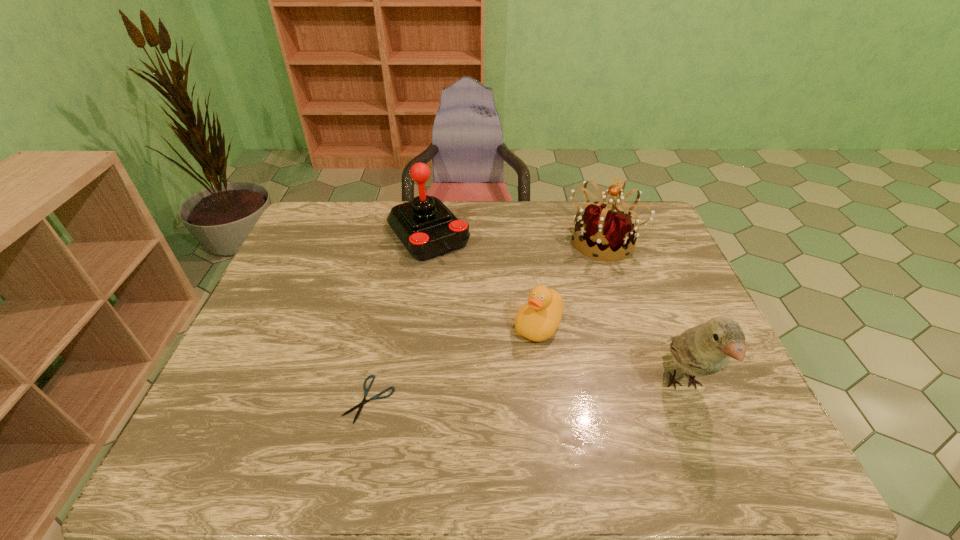
Identify the location of the shortest object. (366, 390).

The width and height of the screenshot is (960, 540). I want to click on bird, so click(705, 349).

I want to click on the third farthest object, so click(537, 320).

At what (x,y) coordinates should I click in order to perform the action: click on the third object from right to left. Please return your answer as a coordinate pair (x, y). Looking at the image, I should click on (537, 320).

This screenshot has width=960, height=540. Find the location of `joystick`. joystick is located at coordinates (427, 228).

Image resolution: width=960 pixels, height=540 pixels. What are the coordinates of `tiara` in the screenshot? It's located at (605, 227).

At what (x,y) coordinates should I click in order to perform the action: click on free region located 0.370m on the back of the shortest object. Please return your answer as a coordinate pair (x, y). Looking at the image, I should click on (396, 272).

Find the location of a particular element. The width and height of the screenshot is (960, 540). vacant space situated on the face of the third nearest object is located at coordinates (492, 392).

Locate an element on the screen. This screenshot has height=540, width=960. vacant space located 0.050m on the face of the third nearest object is located at coordinates (517, 357).

The width and height of the screenshot is (960, 540). In order to click on vacant region located 0.190m on the face of the third nearest object in this screenshot , I will do `click(487, 399)`.